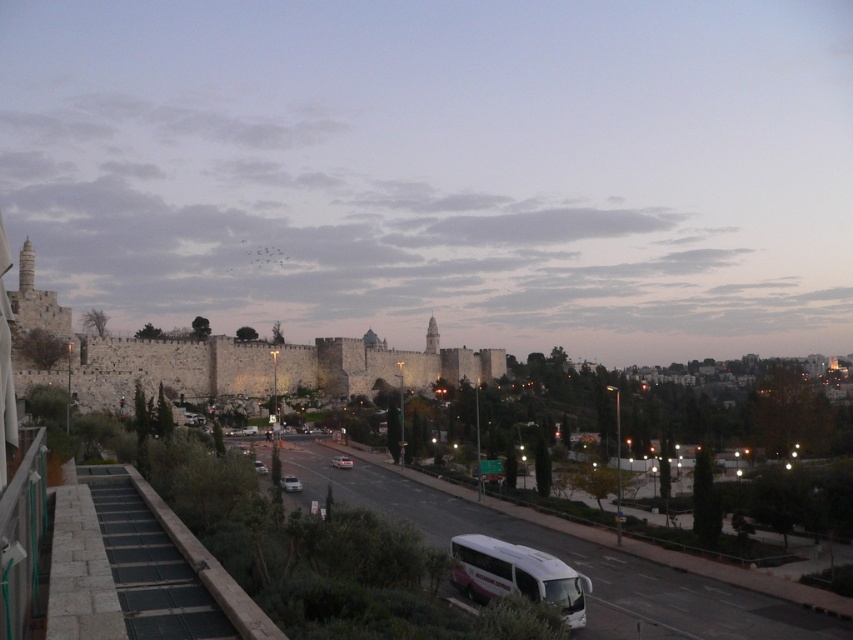
Question: Can you confirm if white matte tour bus at lower center is bigger than silver metallic car at lower center?

Choices:
 (A) no
 (B) yes

Answer: (B)

Question: Among these points, which one is nearest to the camera?

Choices:
 (A) (265, 392)
 (B) (488, 561)

Answer: (B)

Question: Does stone wall at center have a greater width compared to silver metallic sedan at center?

Choices:
 (A) yes
 (B) no

Answer: (A)

Question: Which point is farther to the camera?

Choices:
 (A) (281, 484)
 (B) (521, 580)

Answer: (A)

Question: Which point is closer to the camera?

Choices:
 (A) (520, 577)
 (B) (332, 460)
 (C) (253, 467)

Answer: (A)

Question: Does white matte tour bus at lower center have a larger size compared to silver metallic car at lower center?

Choices:
 (A) no
 (B) yes

Answer: (B)